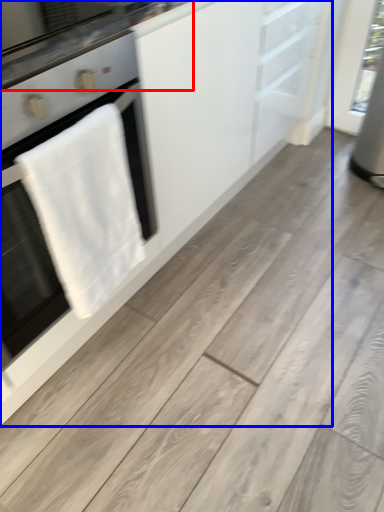
Question: Among these objects, which one is farthest to the camera, countertop (highlighted by a red box) or cabinetry (highlighted by a blue box)?

Choices:
 (A) countertop
 (B) cabinetry

Answer: (A)